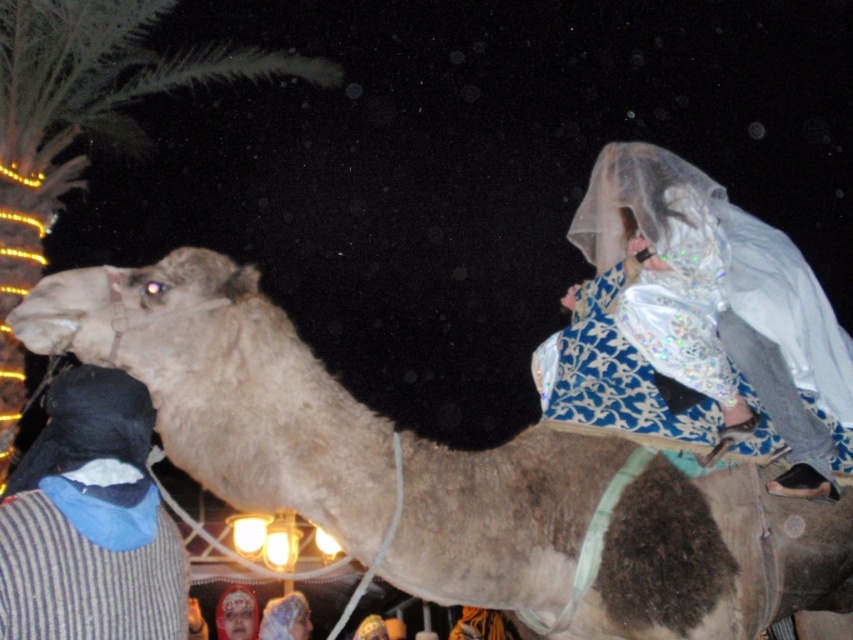
You are a photographer trying to capture the camel and the black fabric in the scene. Since the fuzzy beige camel at center is much taller than the black fabric at left, which object should you focus on first to ensure both are in frame?

The fuzzy beige camel at center is much taller than the black fabric at left, so you should focus on the fuzzy beige camel at center first to ensure both are in frame.

You are a photographer at a cultural event. You notice two items in the image, the shiny silver dress at upper right and the black fabric at left. Which item is closer to the camera?

The shiny silver dress at upper right is closer to the camera because the black fabric at left is behind it.